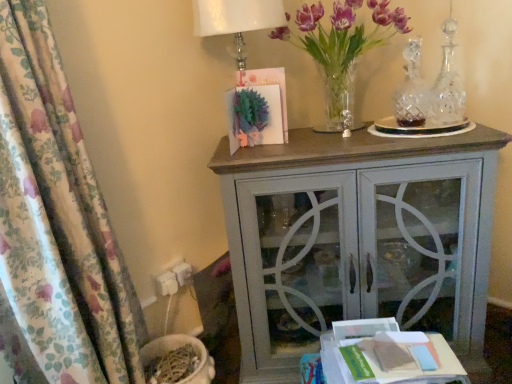
Looking at this image, measure the distance between white paper at lower right and camera.

The depth of white paper at lower right is 3.97 feet.

Locate an element on the screen. matte gray cabinet at center is located at coordinates (354, 231).

Locate an element on the screen. white paper at lower right is located at coordinates (379, 363).

Is matte gray cabinet at center facing away from floral fabric curtain at left?

No, matte gray cabinet at center's orientation is not away from floral fabric curtain at left.

From their relative heights in the image, would you say matte gray cabinet at center is taller or shorter than floral fabric curtain at left?

In the image, matte gray cabinet at center appears to be shorter than floral fabric curtain at left.

Does point (431, 242) come closer to viewer compared to point (16, 359)?

That is False.

Is matte gray cabinet at center inside the boundaries of floral fabric curtain at left, or outside?

matte gray cabinet at center is located beyond the bounds of floral fabric curtain at left.

Does floral fabric curtain at left have a lesser height compared to white paper at lower right?

No.

Considering the sizes of objects floral fabric curtain at left and white paper at lower right in the image provided, who is wider, floral fabric curtain at left or white paper at lower right?

white paper at lower right.

Considering the positions of points (32, 171) and (459, 364), is point (32, 171) closer to camera compared to point (459, 364)?

Yes, it is in front of point (459, 364).

From the image's perspective, is floral fabric curtain at left on top of white paper at lower right?

Yes.

How many degrees apart are the facing directions of purple glass vase at upper right and floral fabric curtain at left?

The angle between the facing direction of purple glass vase at upper right and the facing direction of floral fabric curtain at left is 49 degrees.

Between purple glass vase at upper right and floral fabric curtain at left, which one appears on the left side from the viewer's perspective?

floral fabric curtain at left.

Measure the distance from purple glass vase at upper right to floral fabric curtain at left.

They are 38.13 inches apart.

Locate an element on the screen. This screenshot has height=384, width=512. floral arrangement lying on the right of floral fabric curtain at left is located at coordinates (341, 42).

Consider the image. Are white paper at lower right and purple glass vase at upper right located far from each other?

No, white paper at lower right is not far away from purple glass vase at upper right.

Image resolution: width=512 pixels, height=384 pixels. What are the coordinates of `floral arrangement on the left side of white paper at lower right` in the screenshot? It's located at (341, 42).

Between white paper at lower right and purple glass vase at upper right, which one has smaller width?

With smaller width is white paper at lower right.

From a real-world perspective, which is physically below, white paper at lower right or purple glass vase at upper right?

From a 3D spatial view, white paper at lower right is below.

From the image's perspective, between white paper at lower right and floral fabric curtain at left, who is located below?

white paper at lower right appears lower in the image.

In the image, is white paper at lower right positioned in front of or behind floral fabric curtain at left?

Visually, white paper at lower right is located behind floral fabric curtain at left.

Considering the relative sizes of white paper at lower right and floral fabric curtain at left in the image provided, is white paper at lower right bigger than floral fabric curtain at left?

No.

Considering the positions of objects white paper at lower right and floral fabric curtain at left in the image provided, who is more to the left, white paper at lower right or floral fabric curtain at left?

floral fabric curtain at left.

Which object is further away from the camera, floral fabric curtain at left or matte gray cabinet at center?

matte gray cabinet at center is further from the camera.

Where is `nightstand directly beneath the floral fabric curtain at left (from a real-world perspective)`? Image resolution: width=512 pixels, height=384 pixels. nightstand directly beneath the floral fabric curtain at left (from a real-world perspective) is located at coordinates (354, 231).

Which point is more distant from viewer, (47, 260) or (396, 294)?

The point (396, 294) is more distant.

Is purple glass vase at upper right inside the boundaries of white paper at lower right, or outside?

purple glass vase at upper right exists outside the volume of white paper at lower right.

Between purple glass vase at upper right and white paper at lower right, which one has more height?

With more height is purple glass vase at upper right.

Based on the photo, which of these two, purple glass vase at upper right or white paper at lower right, is smaller?

With smaller size is white paper at lower right.

The image size is (512, 384). There is a matte gray cabinet at center. In order to click on curtain above it (from a real-world perspective) in this screenshot , I will do `click(55, 226)`.

The image size is (512, 384). In order to click on curtain above the white paper at lower right (from the image's perspective) in this screenshot , I will do `click(55, 226)`.

Looking at the image, which one is located further to matte gray cabinet at center, white paper at lower right or purple glass vase at upper right?

The object further to matte gray cabinet at center is purple glass vase at upper right.

When comparing their distances from purple glass vase at upper right, does floral fabric curtain at left or white paper at lower right seem further?

floral fabric curtain at left lies further to purple glass vase at upper right than the other object.

Which object lies further to the anchor point floral fabric curtain at left, matte gray cabinet at center or white paper at lower right?

white paper at lower right is further to floral fabric curtain at left.

Which object lies further to the anchor point white paper at lower right, floral fabric curtain at left or matte gray cabinet at center?

Among the two, floral fabric curtain at left is located further to white paper at lower right.

Based on their spatial positions, is floral fabric curtain at left or matte gray cabinet at center closer to purple glass vase at upper right?

matte gray cabinet at center is positioned closer to the anchor purple glass vase at upper right.

Which object lies nearer to the anchor point floral fabric curtain at left, purple glass vase at upper right or matte gray cabinet at center?

matte gray cabinet at center is closer to floral fabric curtain at left.

Estimate the real-world distances between objects in this image. Which object is further from purple glass vase at upper right, matte gray cabinet at center or floral fabric curtain at left?

Based on the image, floral fabric curtain at left appears to be further to purple glass vase at upper right.

From the image, which object appears to be nearer to matte gray cabinet at center, floral fabric curtain at left or purple glass vase at upper right?

purple glass vase at upper right is closer to matte gray cabinet at center.

Locate an element on the screen. curtain that lies between purple glass vase at upper right and white paper at lower right from top to bottom is located at coordinates (55, 226).

Locate an element on the screen. floral arrangement situated between floral fabric curtain at left and matte gray cabinet at center from left to right is located at coordinates (341, 42).

This screenshot has height=384, width=512. In order to click on nightstand between purple glass vase at upper right and white paper at lower right from top to bottom in this screenshot , I will do `click(354, 231)`.

The image size is (512, 384). Find the location of `nightstand between floral fabric curtain at left and white paper at lower right`. nightstand between floral fabric curtain at left and white paper at lower right is located at coordinates (354, 231).